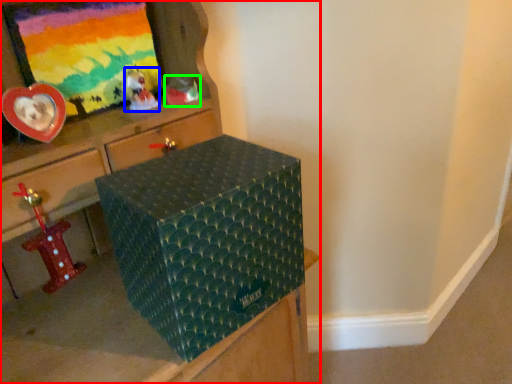
Question: Based on their relative distances, which object is nearer to furniture (highlighted by a red box)? Choose from toy (highlighted by a blue box) and toy (highlighted by a green box).

Choices:
 (A) toy
 (B) toy

Answer: (B)